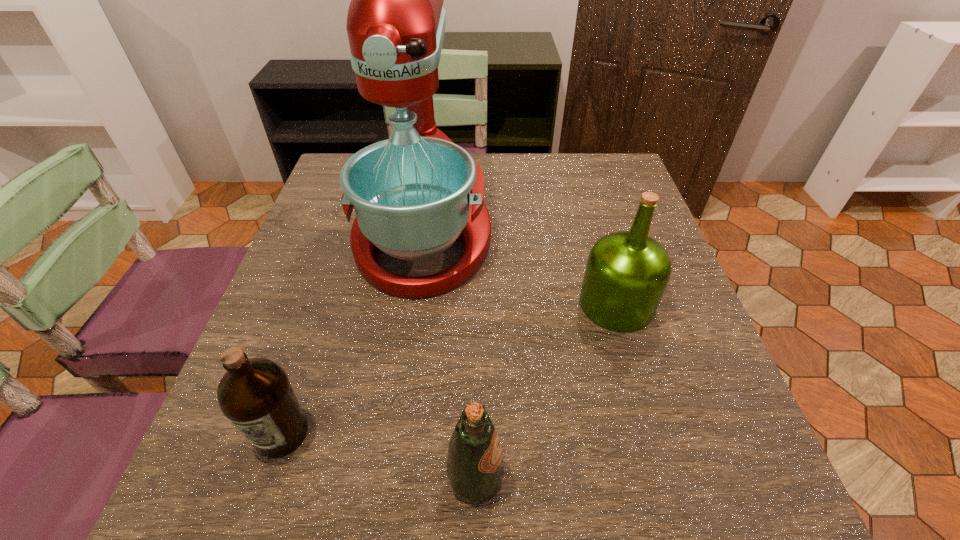
Find the location of a particular element. This screenshot has height=540, width=960. empty space between the second olive oil from right to left and the tallest object is located at coordinates (449, 357).

Locate an element on the screen. The image size is (960, 540). blank region between the leftmost olive oil and the farthest olive oil is located at coordinates (449, 369).

I want to click on empty location between the leftmost olive oil and the rightmost object, so click(449, 369).

Locate an element on the screen. This screenshot has height=540, width=960. free space between the rightmost olive oil and the second olive oil from right to left is located at coordinates (546, 391).

Image resolution: width=960 pixels, height=540 pixels. I want to click on free spot between the tallest olive oil and the second olive oil from right to left, so [x=546, y=391].

This screenshot has width=960, height=540. Find the location of `vacant area between the leftmost olive oil and the second olive oil from left to right`. vacant area between the leftmost olive oil and the second olive oil from left to right is located at coordinates (379, 456).

Where is `empty location between the second olive oil from right to left and the rightmost object`? This screenshot has width=960, height=540. empty location between the second olive oil from right to left and the rightmost object is located at coordinates (546, 391).

The height and width of the screenshot is (540, 960). I want to click on empty location between the tallest object and the second olive oil from left to right, so click(x=449, y=357).

The height and width of the screenshot is (540, 960). Find the location of `vacant space in between the leftmost olive oil and the farthest olive oil`. vacant space in between the leftmost olive oil and the farthest olive oil is located at coordinates (449, 369).

Identify the location of vacant space that is in between the leftmost olive oil and the rightmost olive oil. This screenshot has height=540, width=960. (449, 369).